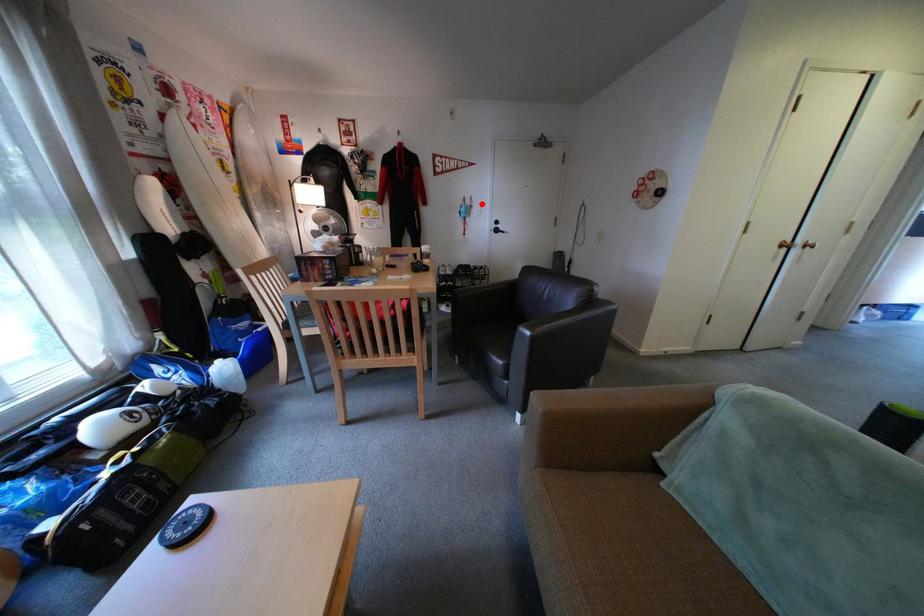
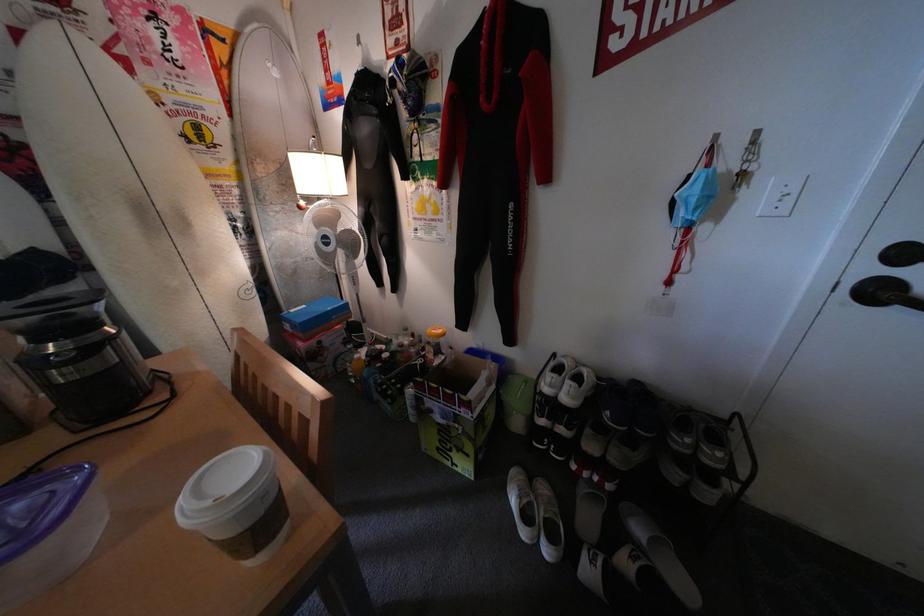
Locate, in the second image, the point that corresponds to the highlighted location in the first image.

(744, 161)